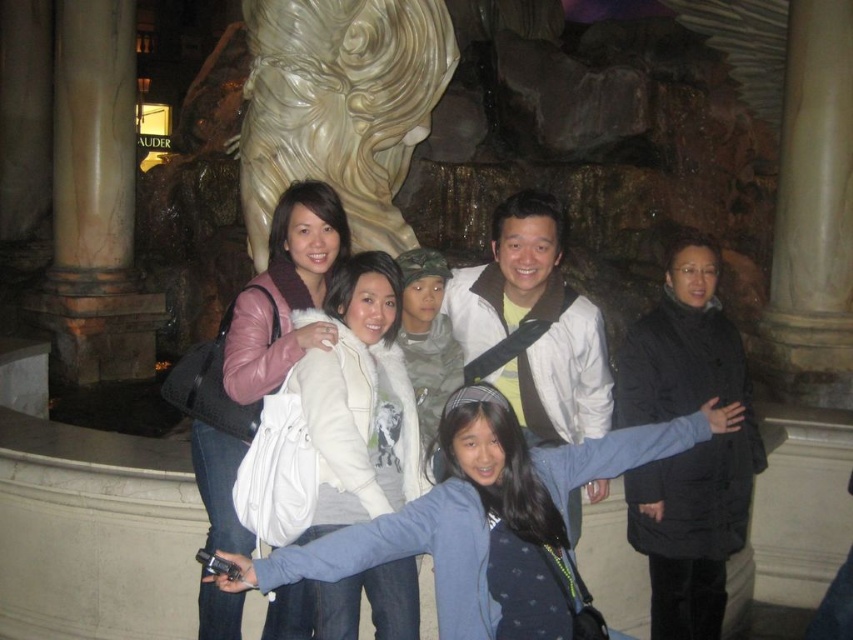
Can you confirm if matte pink leather jacket at center is positioned below white fleece jacket at center?

Actually, matte pink leather jacket at center is above white fleece jacket at center.

Find the location of a particular element. Image resolution: width=853 pixels, height=640 pixels. matte pink leather jacket at center is located at coordinates (285, 291).

Does marble column at left have a lesser height compared to white fleece jacket at center?

No.

Which is behind, point (132, 180) or point (329, 518)?

Point (132, 180)

You are a GUI agent. You are given a task and a screenshot of the screen. Output one action in this format:
    pyautogui.click(x=<x>, y=<y>)
    Task: Click on the marble column at left
    The width and height of the screenshot is (853, 640).
    Given the screenshot: What is the action you would take?
    pyautogui.click(x=94, y=202)

Is point (492, 456) less distant than point (316, 177)?

Yes, it is.

Does light blue sweater at center appear under white marble statue at center?

Yes, light blue sweater at center is below white marble statue at center.

What do you see at coordinates (485, 518) in the screenshot? The width and height of the screenshot is (853, 640). I see `light blue sweater at center` at bounding box center [485, 518].

Identify the location of light blue sweater at center. (485, 518).